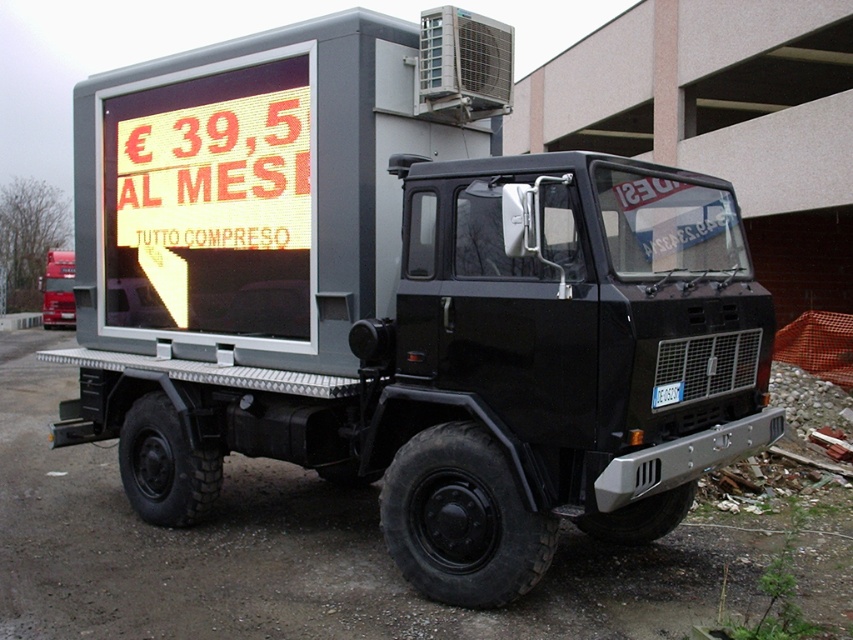
Question: Does gray matte led display at center lie in front of concrete wall at center?

Choices:
 (A) no
 (B) yes

Answer: (B)

Question: Does gray matte led display at center have a smaller size compared to concrete wall at center?

Choices:
 (A) no
 (B) yes

Answer: (B)

Question: Which point is farther to the camera?

Choices:
 (A) gray matte led display at center
 (B) concrete wall at center
 (C) black rubber tire at lower center
 (D) yellow led sign at upper left

Answer: (B)

Question: Which of the following is the farthest from the observer?

Choices:
 (A) gray matte led display at center
 (B) yellow led sign at upper left

Answer: (B)

Question: Does black rubber tire at lower center appear over concrete wall at center?

Choices:
 (A) no
 (B) yes

Answer: (A)

Question: Considering the real-world distances, which object is farthest from the black rubber tire at lower center?

Choices:
 (A) gray matte led display at center
 (B) yellow led sign at upper left

Answer: (A)